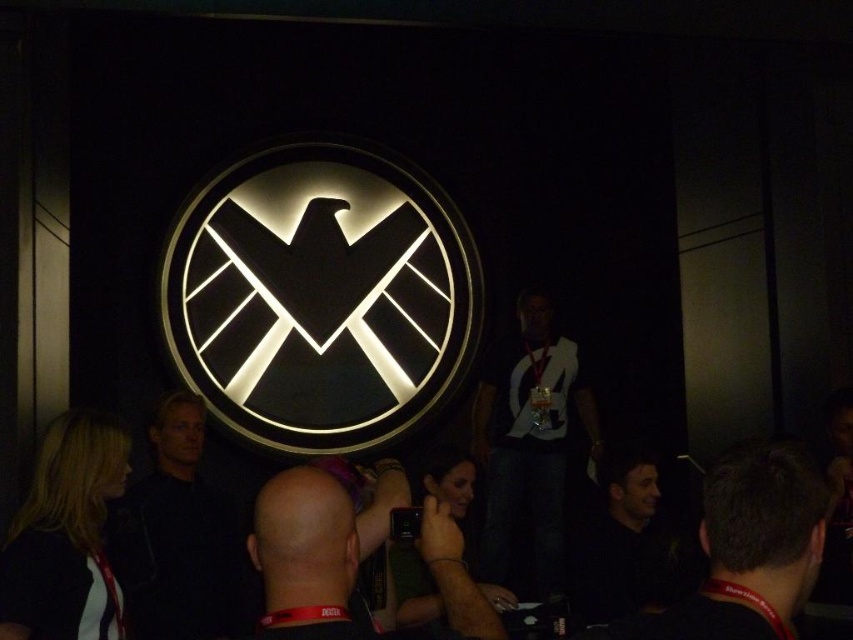
Question: Estimate the real-world distances between objects in this image. Which object is closer to the dark gray shirt at center?

Choices:
 (A) bald head at center
 (B) black matte shirt at left

Answer: (A)

Question: Considering the real-world distances, which object is closest to the black matte hair at lower right?

Choices:
 (A) black matte logo at center
 (B) black matte shirt at left
 (C) dark gray shirt at center
 (D) white glossy shirt at center

Answer: (C)

Question: Can you confirm if black matte shirt at left is wider than white glossy shirt at center?

Choices:
 (A) no
 (B) yes

Answer: (A)

Question: Is black matte logo at center thinner than dark gray shirt at center?

Choices:
 (A) yes
 (B) no

Answer: (B)

Question: Which of the following is the farthest from the observer?

Choices:
 (A) black matte hair at lower right
 (B) white glossy shirt at center

Answer: (B)

Question: Is black matte hair at lower right to the left of dark gray shirt at center from the viewer's perspective?

Choices:
 (A) yes
 (B) no

Answer: (A)